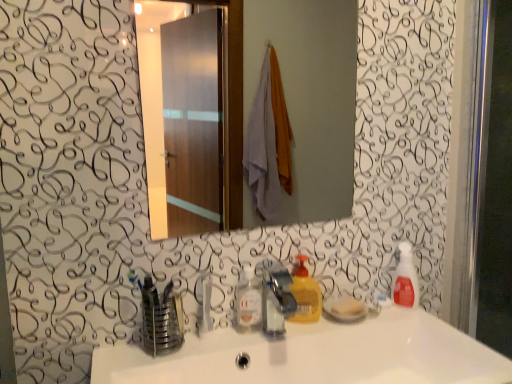
Question: Is metallic reflective mirror at center at the right side of yellow matte liquid soap at center?

Choices:
 (A) yes
 (B) no

Answer: (B)

Question: From a real-world perspective, is metallic reflective mirror at center located beneath yellow matte liquid soap at center?

Choices:
 (A) yes
 (B) no

Answer: (B)

Question: Is metallic reflective mirror at center outside yellow matte liquid soap at center?

Choices:
 (A) yes
 (B) no

Answer: (A)

Question: Is metallic reflective mirror at center further to the viewer compared to yellow matte liquid soap at center?

Choices:
 (A) no
 (B) yes

Answer: (A)

Question: Does metallic reflective mirror at center have a larger size compared to yellow matte liquid soap at center?

Choices:
 (A) yes
 (B) no

Answer: (A)

Question: From the image's perspective, relative to metallic reflective mirror at center, is clear plastic bottle at center above or below?

Choices:
 (A) above
 (B) below

Answer: (B)

Question: In terms of height, does clear plastic bottle at center look taller or shorter compared to metallic reflective mirror at center?

Choices:
 (A) short
 (B) tall

Answer: (A)

Question: In the image, is clear plastic bottle at center positioned in front of or behind metallic reflective mirror at center?

Choices:
 (A) behind
 (B) front

Answer: (A)

Question: From a real-world perspective, is clear plastic bottle at center above or below metallic reflective mirror at center?

Choices:
 (A) above
 (B) below

Answer: (B)

Question: Is satin nickel faucet at center wider or thinner than white glossy sink at center?

Choices:
 (A) thin
 (B) wide

Answer: (A)

Question: From the image's perspective, is satin nickel faucet at center located above or below white glossy sink at center?

Choices:
 (A) below
 (B) above

Answer: (B)

Question: In terms of size, does satin nickel faucet at center appear bigger or smaller than white glossy sink at center?

Choices:
 (A) small
 (B) big

Answer: (A)

Question: Considering their positions, is satin nickel faucet at center located in front of or behind white glossy sink at center?

Choices:
 (A) behind
 (B) front

Answer: (A)

Question: Relative to metallic reflective mirror at center, is satin nickel faucet at center in front or behind?

Choices:
 (A) behind
 (B) front

Answer: (B)

Question: Looking at the image, does satin nickel faucet at center seem bigger or smaller compared to metallic reflective mirror at center?

Choices:
 (A) small
 (B) big

Answer: (A)